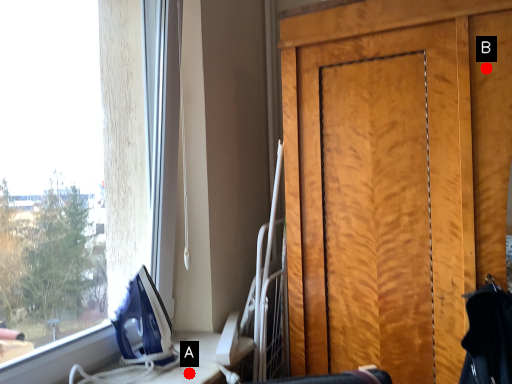
Question: Two points are circled on the image, labeled by A and B beside each circle. Which point appears closest to the camera in this image?

Choices:
 (A) A is closer
 (B) B is closer

Answer: (B)